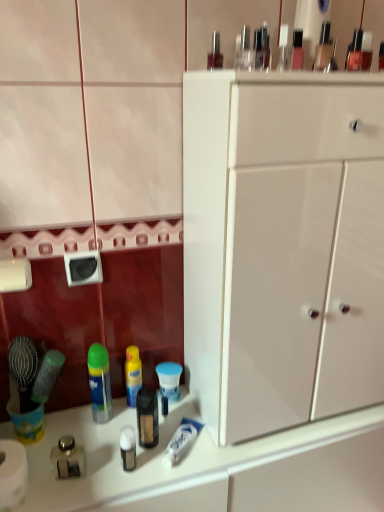
Identify the location of vacant region in front of green plastic mouthwash at center. The width and height of the screenshot is (384, 512). (103, 473).